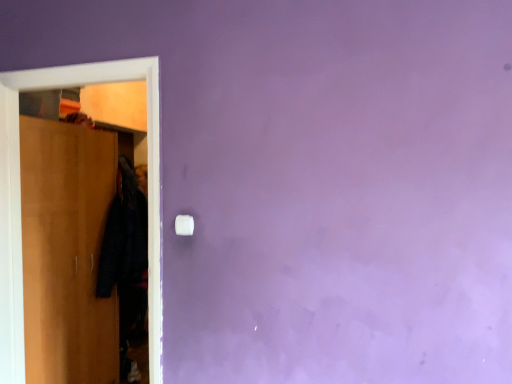
Question: Is black fabric coat at left situated inside wooden wardrobe at left or outside?

Choices:
 (A) outside
 (B) inside

Answer: (A)

Question: Considering their positions, is black fabric coat at left located in front of or behind wooden wardrobe at left?

Choices:
 (A) front
 (B) behind

Answer: (B)

Question: Which object is the closest to the wooden wardrobe at left?

Choices:
 (A) white plastic light switch at center
 (B) black fabric coat at left

Answer: (B)

Question: Which is farther from the wooden wardrobe at left?

Choices:
 (A) black fabric coat at left
 (B) white plastic light switch at center

Answer: (B)